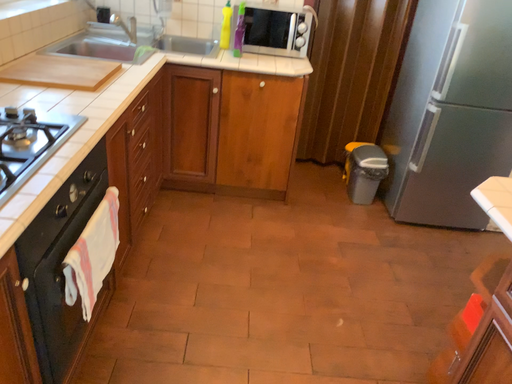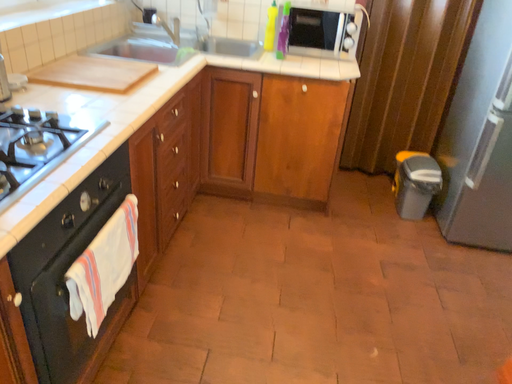
Question: Which way did the camera rotate in the video?

Choices:
 (A) rotated left
 (B) rotated right

Answer: (A)